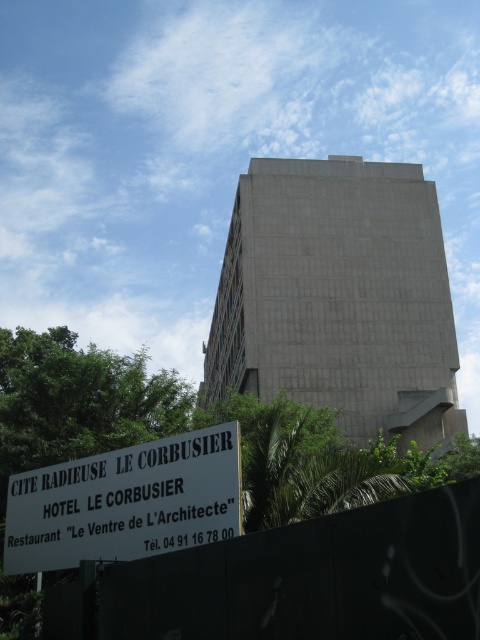
Question: Which object is farther from the camera taking this photo?

Choices:
 (A) white plastic sign at lower left
 (B) black matte fence at lower center

Answer: (A)

Question: Is black matte fence at lower center smaller than white plastic sign at lower left?

Choices:
 (A) yes
 (B) no

Answer: (A)

Question: Is black matte fence at lower center smaller than white plastic sign at lower left?

Choices:
 (A) no
 (B) yes

Answer: (B)

Question: Which object appears closest to the camera in this image?

Choices:
 (A) black matte fence at lower center
 (B) white plastic sign at lower left

Answer: (A)

Question: Among these points, which one is nearest to the camera?

Choices:
 (A) (201, 611)
 (B) (145, 512)

Answer: (A)

Question: Is black matte fence at lower center wider than white plastic sign at lower left?

Choices:
 (A) no
 (B) yes

Answer: (A)